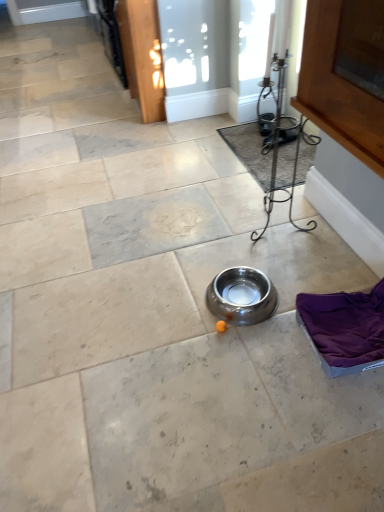
Locate an element on the screen. free space to the left of silver metallic bowl at center is located at coordinates 173,304.